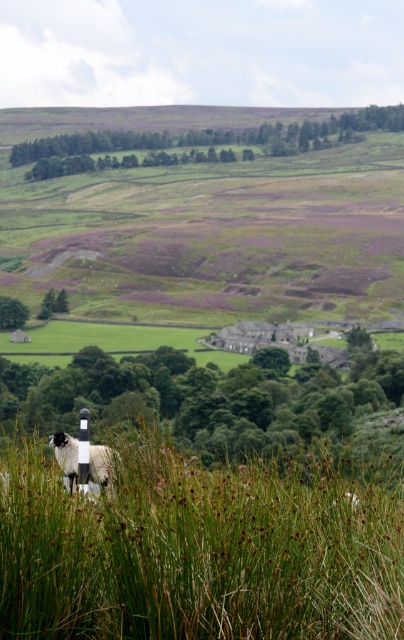
Is green grassy at lower left thinner than black and white woolen sheep at lower left?

In fact, green grassy at lower left might be wider than black and white woolen sheep at lower left.

Does green grassy at lower left have a smaller size compared to black and white woolen sheep at lower left?

Incorrect, green grassy at lower left is not smaller in size than black and white woolen sheep at lower left.

Image resolution: width=404 pixels, height=640 pixels. Find the location of `green grassy at lower left`. green grassy at lower left is located at coordinates (199, 548).